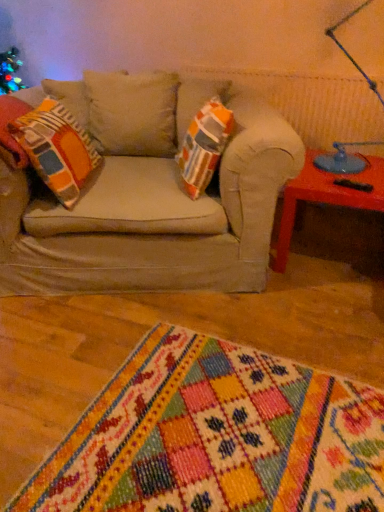
Locate an element on the screen. Image resolution: width=384 pixels, height=512 pixels. empty space that is ontop of matte orange table at right (from a real-world perspective) is located at coordinates (345, 176).